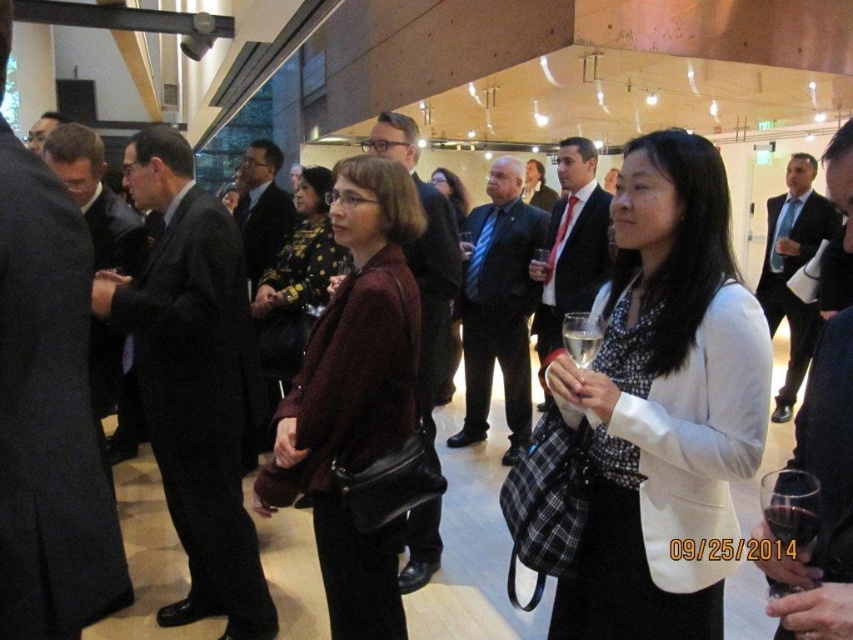
What do you see at coordinates (664, 403) in the screenshot? Image resolution: width=853 pixels, height=640 pixels. I see `white matte blazer at center` at bounding box center [664, 403].

Does white matte blazer at center have a greater height compared to clear glass wine at center?

Indeed, white matte blazer at center has a greater height compared to clear glass wine at center.

You are a GUI agent. You are given a task and a screenshot of the screen. Output one action in this format:
    pyautogui.click(x=<x>, y=<y>)
    Task: Click on the white matte blazer at center
    
    Given the screenshot: What is the action you would take?
    pyautogui.click(x=664, y=403)

What are the coordinates of `maroon woolen jacket at center` in the screenshot? It's located at (355, 396).

At what (x,y) coordinates should I click in order to perform the action: click on maroon woolen jacket at center. Please return your answer as a coordinate pair (x, y). This screenshot has width=853, height=640. Looking at the image, I should click on (355, 396).

The height and width of the screenshot is (640, 853). What are the coordinates of `maroon woolen jacket at center` in the screenshot? It's located at (355, 396).

Between maroon woolen jacket at center and clear glass wine at center, which one is positioned higher?

Positioned higher is clear glass wine at center.

Is maroon woolen jacket at center to the right of clear glass wine at center from the viewer's perspective?

In fact, maroon woolen jacket at center is to the left of clear glass wine at center.

Is point (369, 440) positioned in front of point (577, 328)?

No, (369, 440) is behind (577, 328).

At what (x,y) coordinates should I click in order to perform the action: click on maroon woolen jacket at center. Please return your answer as a coordinate pair (x, y). The image size is (853, 640). Looking at the image, I should click on (355, 396).